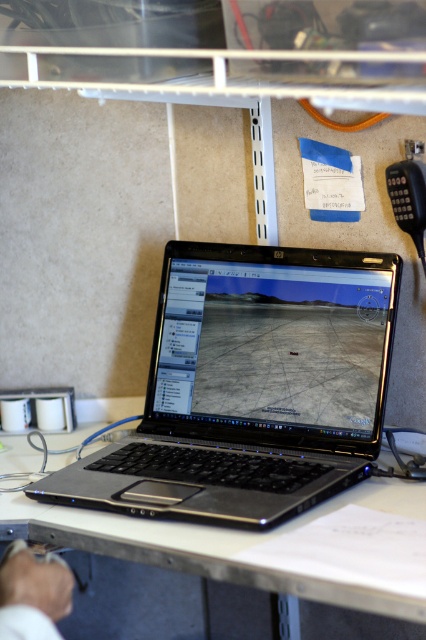
Question: Can you confirm if satin black laptop at center is positioned below white plastic table at center?

Choices:
 (A) yes
 (B) no

Answer: (B)

Question: Which point appears farthest from the camera in this image?

Choices:
 (A) coord(374,488)
 (B) coord(342,280)

Answer: (B)

Question: Among these points, which one is farthest from the camera?

Choices:
 (A) (216, 284)
 (B) (302, 637)
 (C) (23, 570)

Answer: (B)

Question: Which object is farther from the camera taking this photo?

Choices:
 (A) white fabric hand at lower left
 (B) white plastic table at center

Answer: (B)

Question: Is satin black laptop at center to the right of white plastic table at center from the viewer's perspective?

Choices:
 (A) yes
 (B) no

Answer: (A)

Question: Can you confirm if white plastic table at center is bigger than white fabric hand at lower left?

Choices:
 (A) yes
 (B) no

Answer: (A)